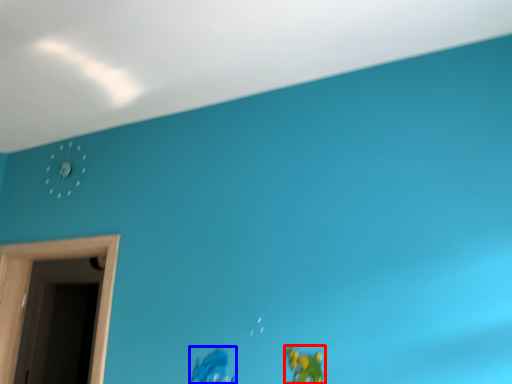
Question: Among these objects, which one is nearest to the camera, toy (highlighted by a red box) or toy (highlighted by a blue box)?

Choices:
 (A) toy
 (B) toy

Answer: (A)